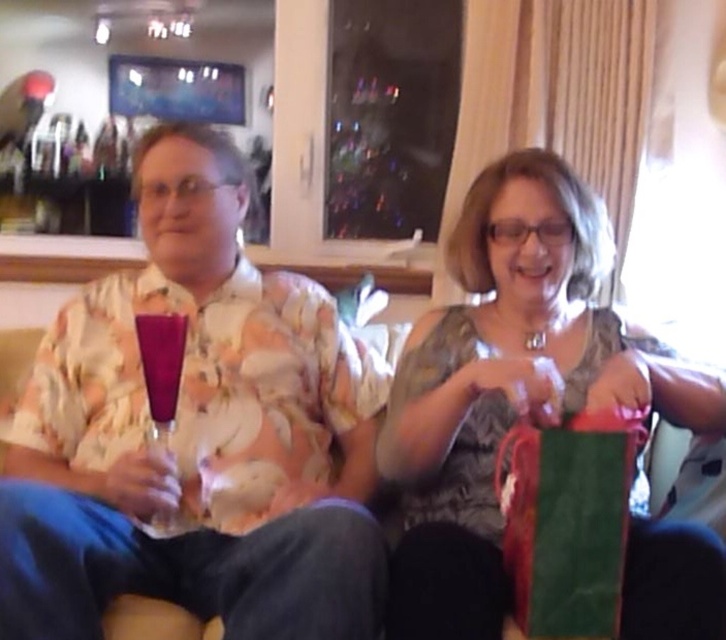
Does point (348, 554) come behind point (163, 404)?

No, it is in front of (163, 404).

How much distance is there between floral shirt at left and matte purple glass at center?

floral shirt at left is 10.45 inches away from matte purple glass at center.

Does point (232, 412) lie behind point (163, 348)?

Yes.

I want to click on floral shirt at left, so click(195, 435).

Can you confirm if green paper bag at center is smaller than transparent glass wine glass at center?

No.

Is point (465, 317) positioned after point (150, 426)?

Yes, it is behind point (150, 426).

Does point (460, 593) come closer to viewer compared to point (163, 522)?

Yes.

The height and width of the screenshot is (640, 726). What are the coordinates of `green paper bag at center` in the screenshot? It's located at (507, 384).

How far apart are transparent glass wine glass at center and matte purple glass at center?

transparent glass wine glass at center and matte purple glass at center are 0.86 inches apart.

Is transparent glass wine glass at center positioned behind matte purple glass at center?

That is False.

What do you see at coordinates (160, 369) in the screenshot? I see `transparent glass wine glass at center` at bounding box center [160, 369].

Where is `transparent glass wine glass at center`? transparent glass wine glass at center is located at coordinates (160, 369).